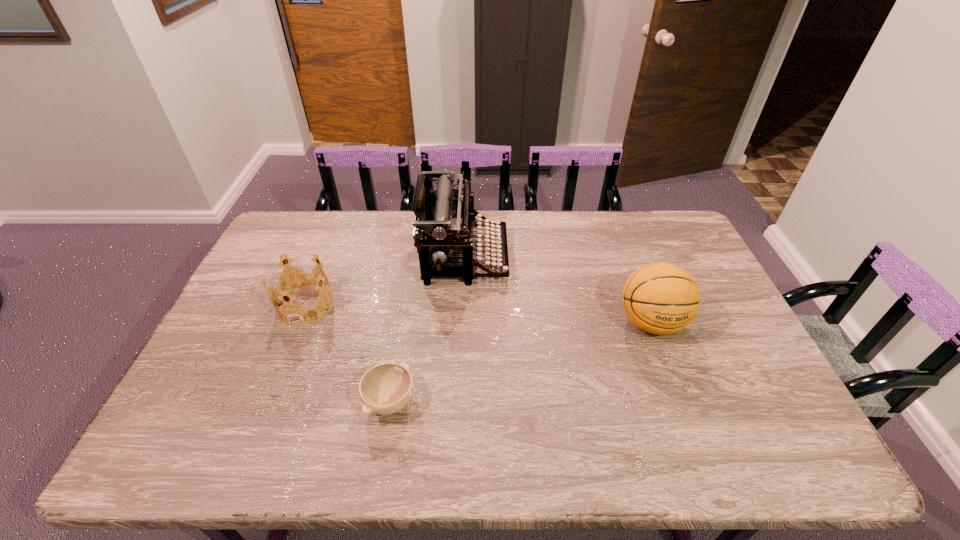
This screenshot has width=960, height=540. What are the coordinates of `vacant space at the near right corner` in the screenshot? It's located at (784, 448).

This screenshot has height=540, width=960. I want to click on unoccupied position between the crown and the second tallest object, so (478, 314).

This screenshot has height=540, width=960. Identify the location of empty location between the shortest object and the typewriter. (427, 328).

The height and width of the screenshot is (540, 960). What are the coordinates of `free space between the typewriter and the crown` in the screenshot? It's located at (385, 280).

The width and height of the screenshot is (960, 540). Find the location of `free area in between the leftmost object and the nearest object`. free area in between the leftmost object and the nearest object is located at coordinates (348, 353).

Where is `free spot between the shortest object and the tallest object`? free spot between the shortest object and the tallest object is located at coordinates (427, 328).

Find the location of `vacant space that's between the typewriter and the nearest object`. vacant space that's between the typewriter and the nearest object is located at coordinates (427, 328).

I want to click on empty location between the leftmost object and the basketball, so click(x=478, y=314).

The width and height of the screenshot is (960, 540). Find the location of `vacant space that's between the crown and the tallest object`. vacant space that's between the crown and the tallest object is located at coordinates (385, 280).

The width and height of the screenshot is (960, 540). Find the location of `vacant area between the basketball and the nearest object`. vacant area between the basketball and the nearest object is located at coordinates (520, 362).